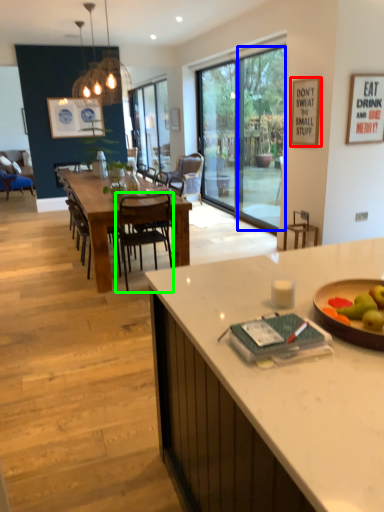
Question: Which is farther away from picture frame (highlighted by a red box)? window screen (highlighted by a blue box) or chair (highlighted by a green box)?

Choices:
 (A) window screen
 (B) chair

Answer: (B)